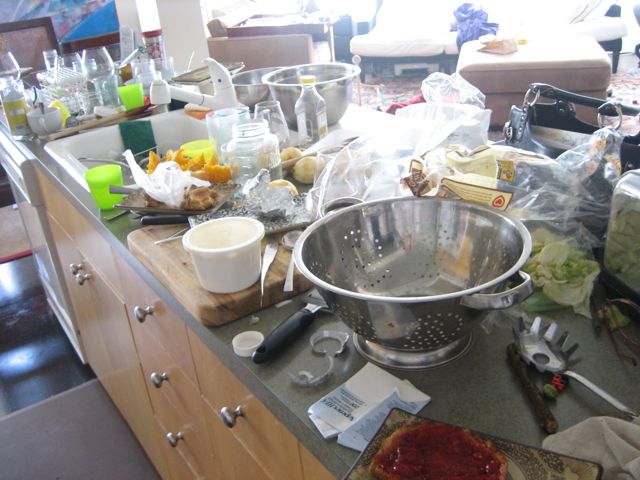
Locate an element on the screen. The image size is (640, 480). silverware is located at coordinates (401, 381), (285, 283), (41, 106), (118, 188).